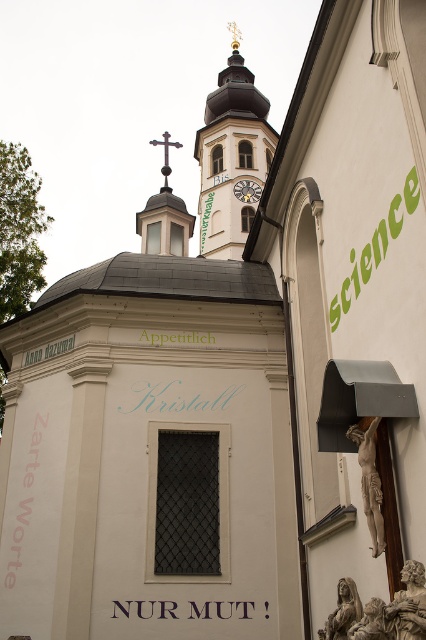
Question: Does goldmetallicspire at upper center come in front of metallic clock face at center?

Choices:
 (A) yes
 (B) no

Answer: (A)

Question: Among these objects, which one is farthest from the camera?

Choices:
 (A) matte brown text at center
 (B) matte white sign at center
 (C) goldmetallicspire at upper center
 (D) light blue calligraphy at center

Answer: (C)

Question: Which object is the closest to the matte brown text at center?

Choices:
 (A) polished dark wood crucifix at center
 (B) light blue calligraphy at center
 (C) green painted text at upper right

Answer: (B)

Question: Which object is farther from the camera taking this photo?

Choices:
 (A) bronze statue at lower right
 (B) pink paper at lower left

Answer: (B)

Question: Is green painted text at upper right positioned at the back of polished dark wood crucifix at center?

Choices:
 (A) yes
 (B) no

Answer: (B)

Question: Does goldmetallicspire at upper center have a lesser width compared to green painted text at upper right?

Choices:
 (A) yes
 (B) no

Answer: (B)